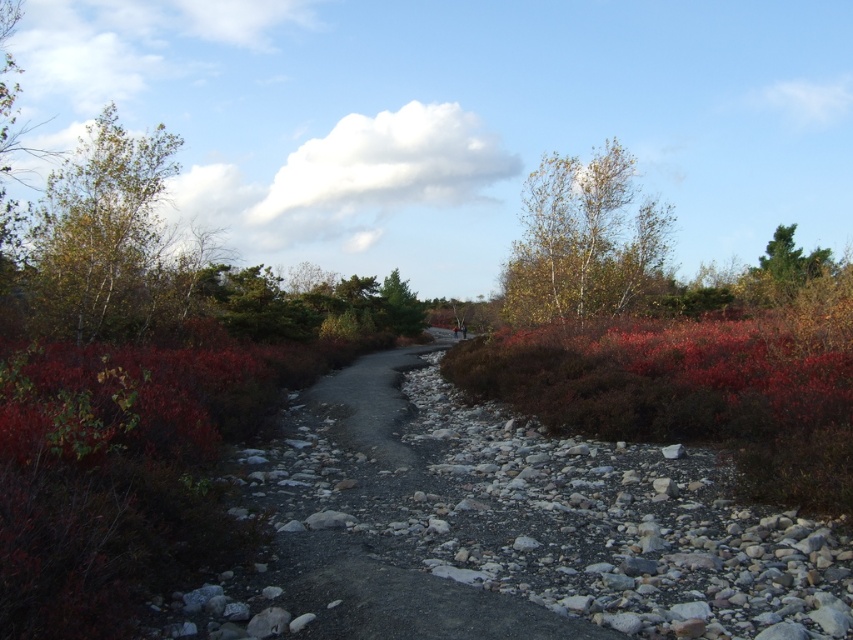
Question: Is green leafy tree at upper right closer to the viewer compared to green matte tree at center?

Choices:
 (A) no
 (B) yes

Answer: (B)

Question: Which point is closer to the camera taking this photo?

Choices:
 (A) (561, 259)
 (B) (409, 330)
 (C) (39, 252)

Answer: (C)

Question: Can you confirm if green leafy tree at upper left is bigger than green matte tree at center?

Choices:
 (A) no
 (B) yes

Answer: (B)

Question: Which is farther from the green matte tree at center?

Choices:
 (A) green leafy tree at upper right
 (B) green leafy tree at upper left

Answer: (B)

Question: Which point appears closest to the camera in this image?

Choices:
 (A) (515, 310)
 (B) (418, 305)
 (C) (119, 241)

Answer: (C)

Question: Where is green leafy tree at upper left located in relation to green leafy tree at upper right in the image?

Choices:
 (A) left
 (B) right

Answer: (A)